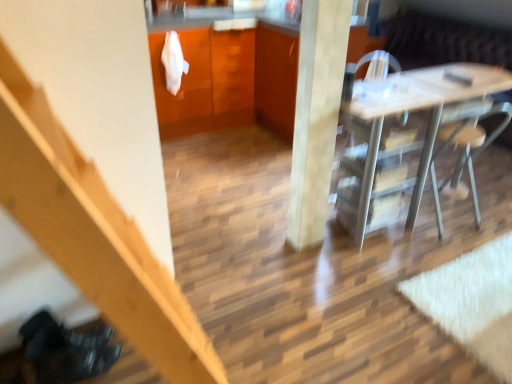
At what (x,y) coordinates should I click in order to perform the action: click on smooth light wood pillar at center. Please return your answer as a coordinate pair (x, y). Looking at the image, I should click on (316, 116).

Locate an element on the screen. The image size is (512, 384). wooden stairs at left is located at coordinates (93, 234).

How much space does wooden cabinet at center, which appears as the 1th cabinetry when viewed from the right, occupy horizontally?

It is 24.62 inches.

Image resolution: width=512 pixels, height=384 pixels. What do you see at coordinates (276, 77) in the screenshot? I see `wooden cabinet at center, which appears as the 1th cabinetry when viewed from the right` at bounding box center [276, 77].

This screenshot has width=512, height=384. I want to click on matte wood dresser at upper center, so click(206, 81).

The image size is (512, 384). Describe the element at coordinates (466, 151) in the screenshot. I see `metallic silver chair at right` at that location.

Where is `smooth light wood pillar at center`? smooth light wood pillar at center is located at coordinates (316, 116).

Looking at this image, between white glossy desk at center and glossy wood cabinetry at center, the second cabinetry in the right-to-left sequence, which one has smaller size?

white glossy desk at center.

From the image's perspective, is white glossy desk at center above glossy wood cabinetry at center, the second cabinetry in the right-to-left sequence?

Incorrect, from the image's perspective, white glossy desk at center is lower than glossy wood cabinetry at center, the second cabinetry in the right-to-left sequence.

Which is behind, white glossy desk at center or glossy wood cabinetry at center, the first cabinetry from the left?

glossy wood cabinetry at center, the first cabinetry from the left, is more distant.

Is white glossy desk at center looking in the opposite direction of glossy wood cabinetry at center, the first cabinetry from the left?

That's right, white glossy desk at center is facing away from glossy wood cabinetry at center, the first cabinetry from the left.

Which object is further away from the camera, glossy wood cabinetry at center, the first cabinetry from the left, or white glossy desk at center?

Positioned behind is glossy wood cabinetry at center, the first cabinetry from the left.

From a real-world perspective, is glossy wood cabinetry at center, the first cabinetry from the left, located beneath white glossy desk at center?

No.

Is glossy wood cabinetry at center, the first cabinetry from the left, oriented away from white glossy desk at center?

No.

Would you say glossy wood cabinetry at center, the first cabinetry from the left, is inside or outside white glossy desk at center?

glossy wood cabinetry at center, the first cabinetry from the left, lies outside white glossy desk at center.

Is wooden stairs at left located outside matte wood dresser at upper center?

Yes, wooden stairs at left is outside of matte wood dresser at upper center.

Does point (105, 201) lie behind point (168, 125)?

No, it is not.

Looking at this image, in terms of width, does wooden stairs at left look wider or thinner when compared to matte wood dresser at upper center?

Considering their sizes, wooden stairs at left looks broader than matte wood dresser at upper center.

Based on the photo, which object is further away from the camera, metallic silver chair at right or white glossy desk at center?

metallic silver chair at right is further away from the camera.

From a real-world perspective, is metallic silver chair at right over white glossy desk at center?

No, from a real-world perspective, metallic silver chair at right is not above white glossy desk at center.

Is point (469, 145) closer or farther from the camera than point (392, 153)?

Point (469, 145).

From the picture: Would you say metallic silver chair at right is inside or outside white glossy desk at center?

metallic silver chair at right is inside white glossy desk at center.

Where is `stairwell that appears below the smooth light wood pillar at center (from the image's perspective)`? The width and height of the screenshot is (512, 384). stairwell that appears below the smooth light wood pillar at center (from the image's perspective) is located at coordinates (93, 234).

Which is closer, (328, 97) or (135, 305)?

The point (135, 305) is in front.

Based on the photo, does smooth light wood pillar at center turn towards wooden stairs at left?

No, smooth light wood pillar at center is not facing towards wooden stairs at left.

Is wooden cabinet at center, positioned as the 2th cabinetry in left-to-right order, wider or thinner than glossy wood cabinetry at center, the second cabinetry in the right-to-left sequence?

Clearly, wooden cabinet at center, positioned as the 2th cabinetry in left-to-right order, has less width compared to glossy wood cabinetry at center, the second cabinetry in the right-to-left sequence.

Which is more to the right, wooden cabinet at center, which appears as the 1th cabinetry when viewed from the right, or glossy wood cabinetry at center, the first cabinetry from the left?

wooden cabinet at center, which appears as the 1th cabinetry when viewed from the right.

Is wooden cabinet at center, positioned as the 2th cabinetry in left-to-right order, shorter than glossy wood cabinetry at center, the second cabinetry in the right-to-left sequence?

Yes, wooden cabinet at center, positioned as the 2th cabinetry in left-to-right order, is shorter than glossy wood cabinetry at center, the second cabinetry in the right-to-left sequence.

How far apart are wooden cabinet at center, positioned as the 2th cabinetry in left-to-right order, and glossy wood cabinetry at center, the second cabinetry in the right-to-left sequence?

A distance of 7.40 inches exists between wooden cabinet at center, positioned as the 2th cabinetry in left-to-right order, and glossy wood cabinetry at center, the second cabinetry in the right-to-left sequence.

From the image's perspective, is white glossy desk at center on top of smooth light wood pillar at center?

No, from the image's perspective, white glossy desk at center is not over smooth light wood pillar at center.

Does white glossy desk at center come behind smooth light wood pillar at center?

Yes, it is behind smooth light wood pillar at center.

At what (x,y) coordinates should I click in order to perform the action: click on cabinetry that is the 2nd object to the left of the white glossy desk at center, starting at the anchor. Please return your answer as a coordinate pair (x, y). This screenshot has width=512, height=384. Looking at the image, I should click on (230, 80).

The image size is (512, 384). What are the coordinates of `the 2nd cabinetry located above the white glossy desk at center (from a real-world perspective)` in the screenshot? It's located at (230, 80).

Based on their spatial positions, is glossy wood cabinetry at center, the first cabinetry from the left, or white glossy desk at center further from wooden stairs at left?

glossy wood cabinetry at center, the first cabinetry from the left, lies further to wooden stairs at left than the other object.

Estimate the real-world distances between objects in this image. Which object is further from matte wood dresser at upper center, metallic silver chair at right or smooth light wood pillar at center?

The object further to matte wood dresser at upper center is metallic silver chair at right.

When comparing their distances from wooden cabinet at center, which appears as the 1th cabinetry when viewed from the right, does metallic silver chair at right or matte wood dresser at upper center seem further?

Based on the image, metallic silver chair at right appears to be further to wooden cabinet at center, which appears as the 1th cabinetry when viewed from the right.

Based on their spatial positions, is metallic silver chair at right or matte wood dresser at upper center closer to glossy wood cabinetry at center, the second cabinetry in the right-to-left sequence?

matte wood dresser at upper center is positioned closer to the anchor glossy wood cabinetry at center, the second cabinetry in the right-to-left sequence.

Consider the image. Looking at the image, which one is located further to smooth light wood pillar at center, matte wood dresser at upper center or metallic silver chair at right?

Based on the image, matte wood dresser at upper center appears to be further to smooth light wood pillar at center.

From the image, which object appears to be farther from white glossy desk at center, smooth light wood pillar at center or wooden stairs at left?

wooden stairs at left lies further to white glossy desk at center than the other object.

Which object lies nearer to the anchor point smooth light wood pillar at center, metallic silver chair at right or matte wood dresser at upper center?

Based on the image, metallic silver chair at right appears to be nearer to smooth light wood pillar at center.

Estimate the real-world distances between objects in this image. Which object is closer to white glossy desk at center, matte wood dresser at upper center or metallic silver chair at right?

metallic silver chair at right lies closer to white glossy desk at center than the other object.

Identify the location of chair positioned between wooden stairs at left and glossy wood cabinetry at center, the first cabinetry from the left, from near to far. Image resolution: width=512 pixels, height=384 pixels. (466, 151).

The image size is (512, 384). Identify the location of desk positioned between wooden stairs at left and glossy wood cabinetry at center, the second cabinetry in the right-to-left sequence, from near to far. (416, 110).

Find the location of a particular element. The height and width of the screenshot is (384, 512). pillar between wooden stairs at left and matte wood dresser at upper center in the front-back direction is located at coordinates (316, 116).

You are a GUI agent. You are given a task and a screenshot of the screen. Output one action in this format:
    pyautogui.click(x=<x>, y=<y>)
    Task: Click on the cabinetry between glossy wood cabinetry at center, the first cabinetry from the left, and matte wood dresser at upper center from front to back
    This screenshot has height=384, width=512.
    Given the screenshot: What is the action you would take?
    pyautogui.click(x=276, y=77)